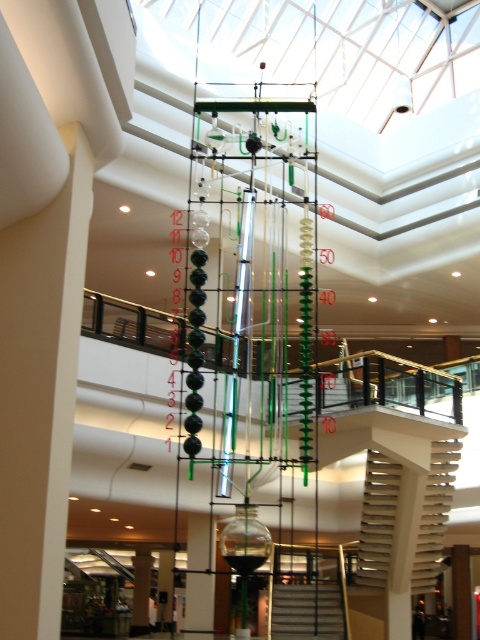
Question: Is white textured stairs at center bigger than smooth white stairs at center?

Choices:
 (A) no
 (B) yes

Answer: (B)

Question: Which of the following is the farthest from the observer?

Choices:
 (A) (456, 438)
 (B) (280, 621)

Answer: (A)

Question: Can you confirm if white textured stairs at center is thinner than smooth white stairs at center?

Choices:
 (A) yes
 (B) no

Answer: (B)

Question: Among these objects, which one is nearest to the camera?

Choices:
 (A) white textured stairs at center
 (B) smooth white stairs at center

Answer: (B)

Question: Is white textured stairs at center to the right of smooth white stairs at center from the viewer's perspective?

Choices:
 (A) no
 (B) yes

Answer: (B)